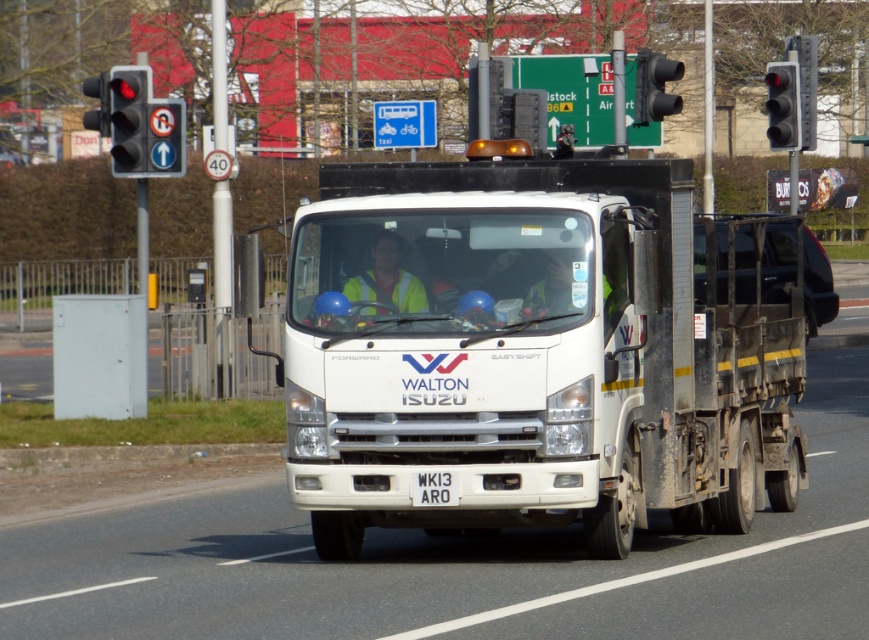
You are a driver approaching the intersection where the white Isuzu truck is stopped. The truck has a flatbed trailer and displays the Walton logo. You need to determine if you can safely pass the truck before the traffic light turns green. Considering the distance of the black plastic traffic light at upper right from the viewer is 24.79 meters, can you estimate how much time you have before the traffic light might turn green?

The distance of the black plastic traffic light at upper right from the viewer is 24.79 meters. However, without knowing the speed of your vehicle or the traffic light cycle duration, it is impossible to accurately estimate the time before the light turns green. You should proceed with caution and follow traffic signals.